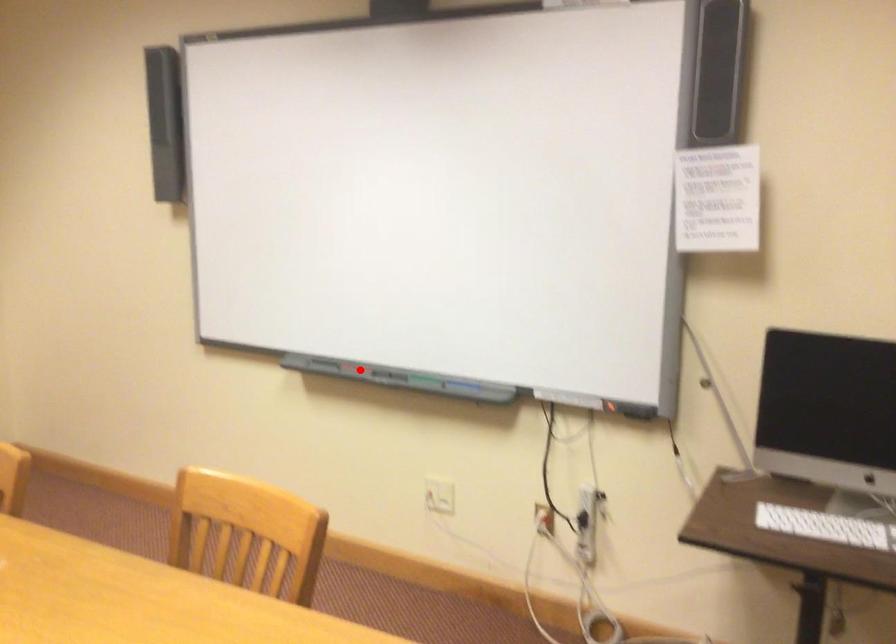
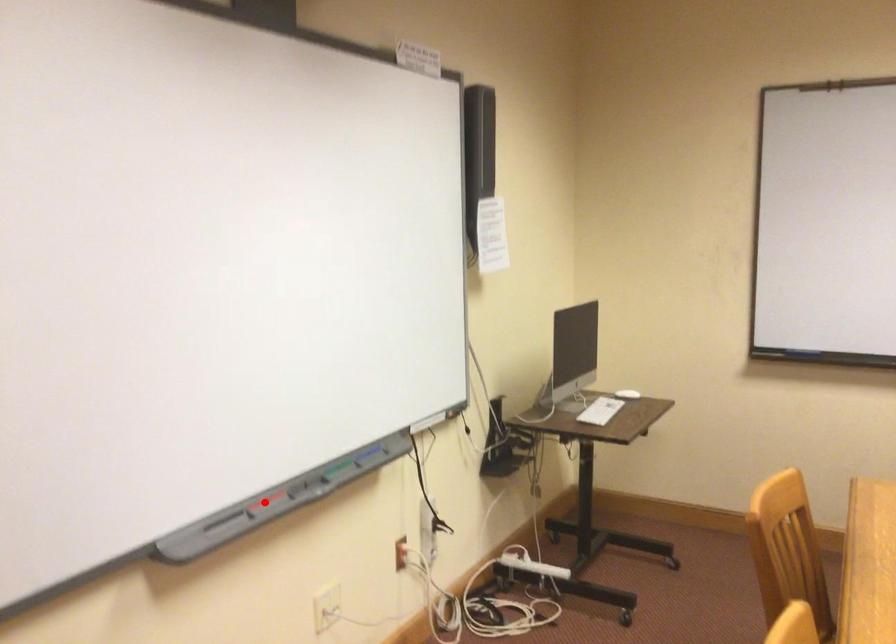
I am providing you with two images of the same scene from different viewpoints. A red point is marked on the first image and another point is marked on the second image. Is the red point in image1 aligned with the point shown in image2?

Yes